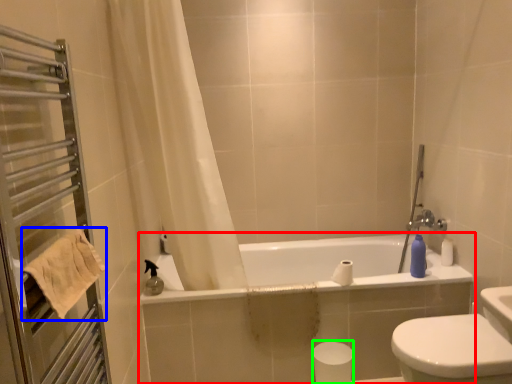
Question: Estimate the real-world distances between objects in this image. Which object is closer to bathtub (highlighted by a red box), towel/napkin (highlighted by a blue box) or toilet paper (highlighted by a green box)?

Choices:
 (A) towel/napkin
 (B) toilet paper

Answer: (B)